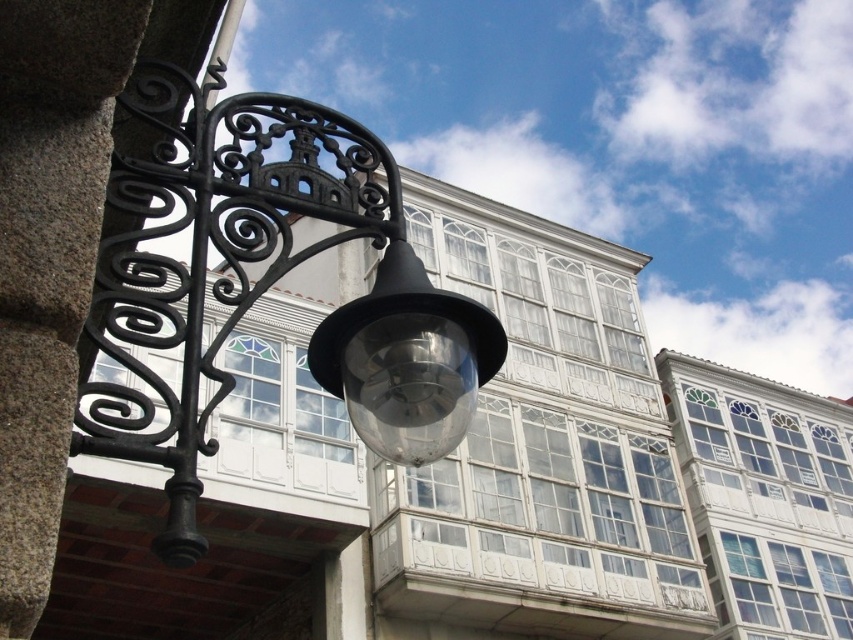
Question: Which object is closer to the camera taking this photo?

Choices:
 (A) black wrought iron at left
 (B) transparent glass light fixture at center
 (C) matte black lamp at left

Answer: (C)

Question: Estimate the real-world distances between objects in this image. Which object is farther from the transparent glass light fixture at center?

Choices:
 (A) black wrought iron at left
 (B) matte black lamp at left

Answer: (A)

Question: Which point is closer to the camera?

Choices:
 (A) (199, 554)
 (B) (352, 422)
 (C) (323, 212)

Answer: (A)

Question: Does matte black lamp at left appear on the right side of transparent glass light fixture at center?

Choices:
 (A) yes
 (B) no

Answer: (B)

Question: Observing the image, what is the correct spatial positioning of matte black lamp at left in reference to transparent glass light fixture at center?

Choices:
 (A) right
 (B) left

Answer: (B)

Question: Can you confirm if matte black lamp at left is positioned above transparent glass light fixture at center?

Choices:
 (A) no
 (B) yes

Answer: (B)